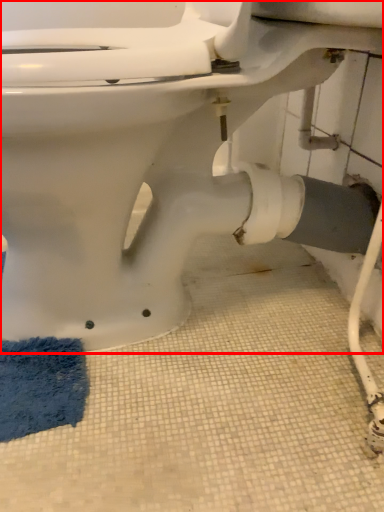
Question: Where is toilet (annotated by the red box) located in relation to bath mat in the image?

Choices:
 (A) left
 (B) right

Answer: (B)